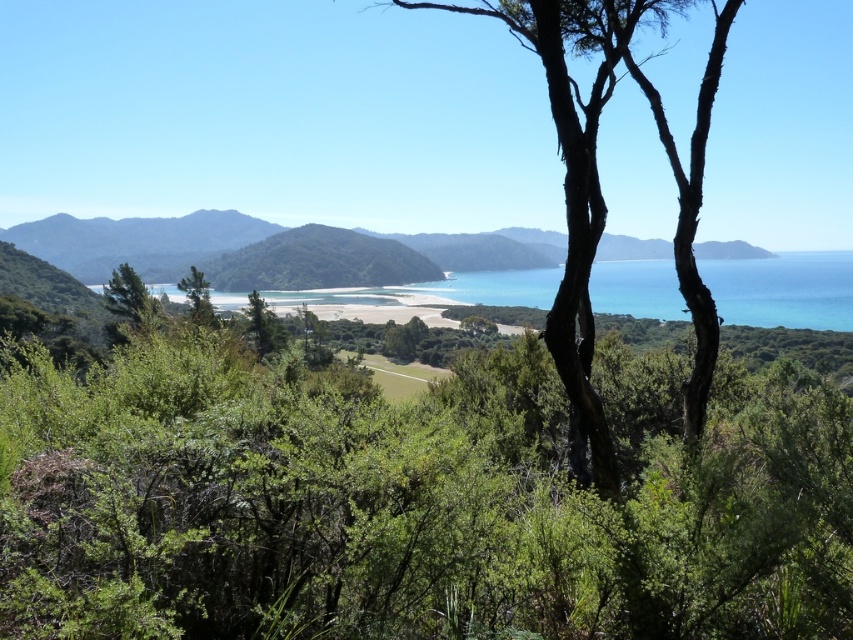
Consider the image. What is the spatial relationship between the green grassy mountain at center and the turquoise glossy water at center in the scene?

The green grassy mountain at center is closer to the viewer than the turquoise glossy water at center.

You are standing on the beach and want to take a photo of the green grassy mountain at center and the turquoise glossy water at center. Which object should you place on the left side of your photo frame?

The green grassy mountain at center is positioned on the left side of turquoise glossy water at center, so you should place the green grassy mountain at center on the left side of your photo frame.

You are standing at the edge of the beach in the coastal landscape scene. You see two points marked in the image. Which point is closer to you, point (x=180, y=243) or point (x=506, y=301)?

Point (x=180, y=243) is closer to you because it is further to the viewer than point (x=506, y=301).